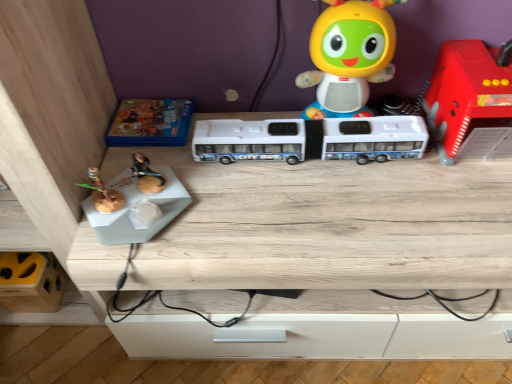
Find the location of a particular element. This screenshot has width=512, height=384. vacant space to the right of blue cardboard box at upper left, the second toy in the left-to-right sequence is located at coordinates (229, 114).